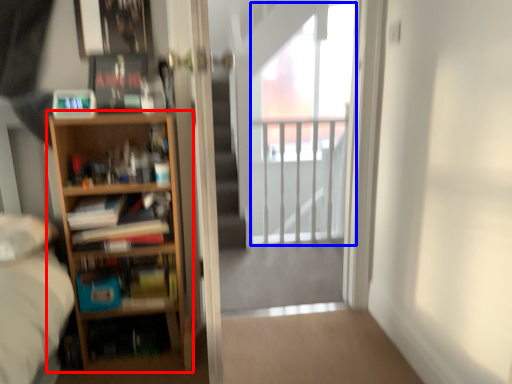
Question: Among these objects, which one is farthest to the camera, bookcase (highlighted by a red box) or window (highlighted by a blue box)?

Choices:
 (A) bookcase
 (B) window

Answer: (B)